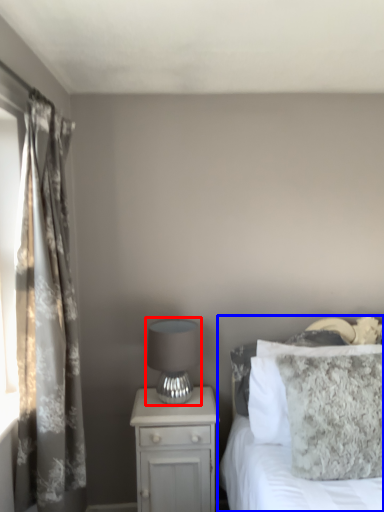
Question: Which of the following is the closest to the observer, table lamp (highlighted by a red box) or bed (highlighted by a blue box)?

Choices:
 (A) table lamp
 (B) bed

Answer: (B)